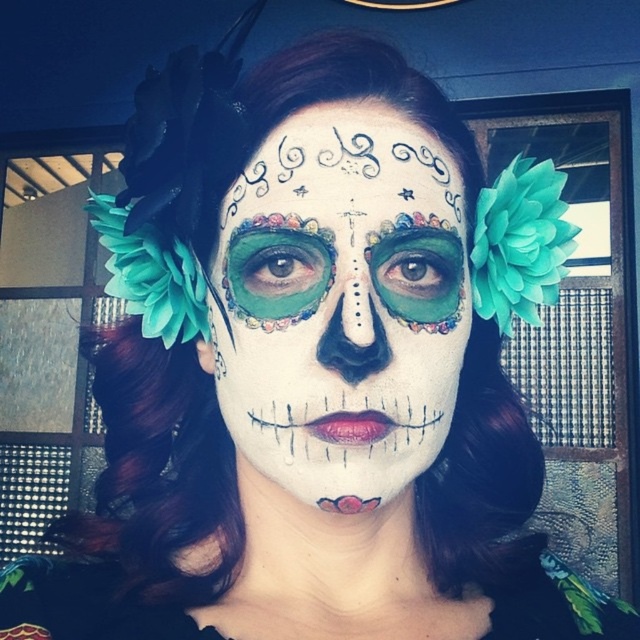
Is white matte face paint at center positioned in front of matte black dress at center?

Yes, it is.

Does white matte face paint at center have a larger size compared to matte black dress at center?

Indeed, white matte face paint at center has a larger size compared to matte black dress at center.

Which is behind, point (353, 413) or point (45, 563)?

Positioned behind is point (45, 563).

Find the location of a particular element. The height and width of the screenshot is (640, 640). white matte face paint at center is located at coordinates (340, 304).